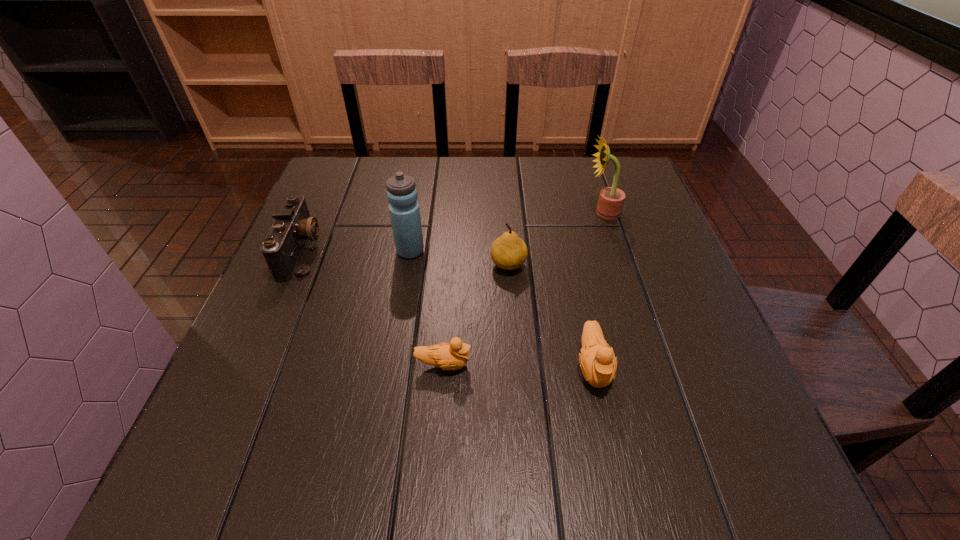
The image size is (960, 540). In order to click on the shortest object in this screenshot , I will do `click(449, 356)`.

Find the location of a particular element. the left duckling is located at coordinates (449, 356).

The image size is (960, 540). In order to click on the second object from right to left in this screenshot , I will do `click(598, 363)`.

I want to click on the taller duckling, so click(x=598, y=363).

Locate an element on the screen. The width and height of the screenshot is (960, 540). the rightmost object is located at coordinates (611, 199).

Image resolution: width=960 pixels, height=540 pixels. I want to click on water bottle, so click(402, 195).

You are a GUI agent. You are given a task and a screenshot of the screen. Output one action in this format:
    pyautogui.click(x=<x>, y=<y>)
    Task: Click on the leftmost object
    Image resolution: width=960 pixels, height=540 pixels.
    Given the screenshot: What is the action you would take?
    pyautogui.click(x=283, y=246)

Find the location of a particular element. pear is located at coordinates (508, 252).

Where is `vacant space positioned 0.210m on the face of the shorter duckling`? The image size is (960, 540). vacant space positioned 0.210m on the face of the shorter duckling is located at coordinates (587, 364).

Find the location of a particular element. This screenshot has height=540, width=960. vacant space located 0.170m on the face of the rightmost object is located at coordinates (518, 212).